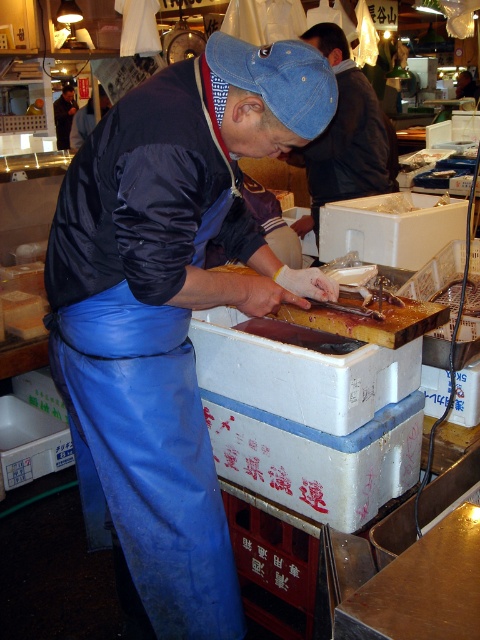
Who is higher up, blue rubber apron at center or blue denim cap at upper center?

blue denim cap at upper center is higher up.

Is blue rubber apron at center below blue denim cap at upper center?

Indeed, blue rubber apron at center is positioned under blue denim cap at upper center.

Who is more distant from viewer, (99, 241) or (393, 140)?

Point (393, 140)

Find the location of a particular element. The width and height of the screenshot is (480, 640). blue rubber apron at center is located at coordinates (169, 310).

This screenshot has width=480, height=640. Find the location of `blue rubber apron at center`. blue rubber apron at center is located at coordinates (169, 310).

Is point (282, 140) farther from camera compared to point (70, 84)?

No, it is in front of (70, 84).

You are a GUI agent. You are given a task and a screenshot of the screen. Output one action in this format:
    pyautogui.click(x=<x>, y=<y>)
    Task: Click on the blue rubber apron at center
    
    Given the screenshot: What is the action you would take?
    pyautogui.click(x=169, y=310)

This screenshot has height=640, width=480. What are the coordinates of `blue rubber apron at center` in the screenshot? It's located at 169,310.

Between blue denim cap at upper center and dark blue apron at lower left, which one is positioned lower?

blue denim cap at upper center is below.

Locate an element on the screen. The image size is (480, 640). blue denim cap at upper center is located at coordinates (345, 136).